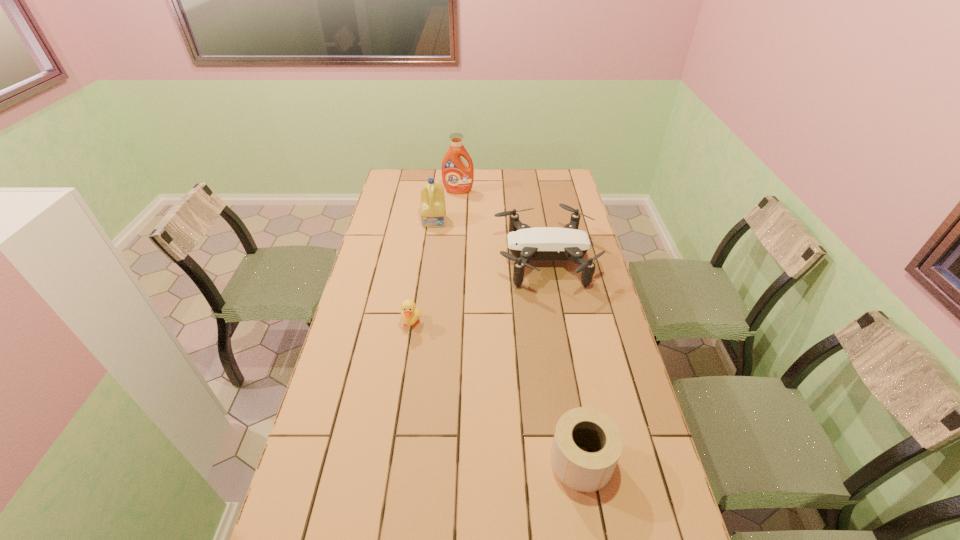
The height and width of the screenshot is (540, 960). In the image, there is a desktop. What are the coordinates of `vacant space at the far left corner` in the screenshot? It's located at (418, 191).

I want to click on free location at the far right corner, so click(x=539, y=172).

You are a GUI agent. You are given a task and a screenshot of the screen. Output one action in this format:
    pyautogui.click(x=<x>, y=<y>)
    Task: Click on the vacant area that lies between the farther detergent and the nearer detergent
    
    Given the screenshot: What is the action you would take?
    pyautogui.click(x=446, y=206)

You are a GUI agent. You are given a task and a screenshot of the screen. Output one action in this format:
    pyautogui.click(x=<x>, y=<y>)
    Task: Click on the unoccupied position between the nearest object and the drone
    The image size is (960, 540).
    Given the screenshot: What is the action you would take?
    pyautogui.click(x=564, y=361)

In order to click on free space between the shorter detergent and the tallest object in this screenshot , I will do `click(446, 206)`.

At what (x,y) coordinates should I click in order to perform the action: click on free spot between the taller detergent and the second tallest object. Please return your answer as a coordinate pair (x, y). This screenshot has height=540, width=960. Looking at the image, I should click on (446, 206).

Locate an element on the screen. free area in between the nearer detergent and the tallest object is located at coordinates (446, 206).

This screenshot has width=960, height=540. What are the coordinates of `vacant area between the toilet tissue and the farthest object` in the screenshot? It's located at (520, 326).

At what (x,y) coordinates should I click in order to perform the action: click on empty space between the duckling and the third farthest object. Please return your answer as a coordinate pair (x, y). This screenshot has height=540, width=960. Looking at the image, I should click on (478, 292).

This screenshot has width=960, height=540. Identify the location of object that stands as the closest to the third nearest object. (433, 210).